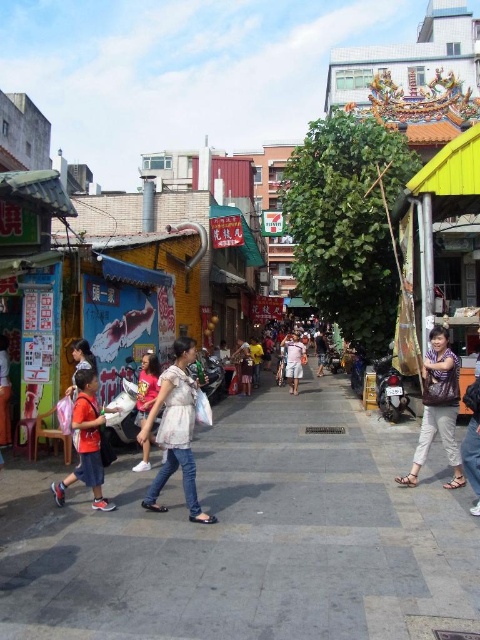
Question: Which point is closer to the camera?

Choices:
 (A) (292, 362)
 (B) (244, 390)
 (C) (166, 397)
 (D) (316, 372)

Answer: (C)

Question: Does white cotton shorts at center have a greater width compared to light blue denim shorts at center?

Choices:
 (A) no
 (B) yes

Answer: (B)

Question: Does gray concrete pavement at center have a smaller size compared to matte red backpack at left?

Choices:
 (A) yes
 (B) no

Answer: (B)

Question: Which object appears farthest from the camera in this image?

Choices:
 (A) light blue denim shorts at center
 (B) white cotton shorts at center
 (C) patterned fabric shirt at right
 (D) gray concrete pavement at center

Answer: (A)

Question: Which object is farther from the camera taking this photo?

Choices:
 (A) pink cotton shirt at center
 (B) patterned fabric shirt at right
 (C) gray concrete pavement at center
 (D) matte red backpack at left

Answer: (A)

Question: Does matte red backpack at left lie in front of light blue denim shorts at center?

Choices:
 (A) no
 (B) yes

Answer: (B)